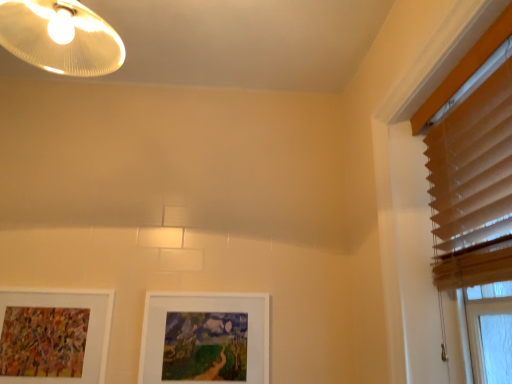
Question: From the image's perspective, does white matte picture frame at center, acting as the first picture frame starting from the right, appear lower than matte white lampshade at upper left?

Choices:
 (A) no
 (B) yes

Answer: (B)

Question: Does white matte picture frame at center, the 2th picture frame in the left-to-right sequence, appear on the right side of matte white lampshade at upper left?

Choices:
 (A) yes
 (B) no

Answer: (A)

Question: Considering the relative sizes of white matte picture frame at center, the 2th picture frame in the left-to-right sequence, and matte white lampshade at upper left in the image provided, is white matte picture frame at center, the 2th picture frame in the left-to-right sequence, wider than matte white lampshade at upper left?

Choices:
 (A) yes
 (B) no

Answer: (B)

Question: Is white matte picture frame at center, the 2th picture frame in the left-to-right sequence, looking in the opposite direction of matte white lampshade at upper left?

Choices:
 (A) no
 (B) yes

Answer: (A)

Question: Is matte white lampshade at upper left completely or partially inside white matte picture frame at center, the 2th picture frame in the left-to-right sequence?

Choices:
 (A) yes
 (B) no

Answer: (B)

Question: Is white matte picture frame at center, acting as the first picture frame starting from the right, outside of matte white lampshade at upper left?

Choices:
 (A) no
 (B) yes

Answer: (B)

Question: From a real-world perspective, is matte white lampshade at upper left physically below white matte picture frame at lower left, marked as the second picture frame in a right-to-left arrangement?

Choices:
 (A) yes
 (B) no

Answer: (B)

Question: Considering the relative sizes of matte white lampshade at upper left and white matte picture frame at lower left, marked as the second picture frame in a right-to-left arrangement, in the image provided, is matte white lampshade at upper left thinner than white matte picture frame at lower left, marked as the second picture frame in a right-to-left arrangement,?

Choices:
 (A) yes
 (B) no

Answer: (B)

Question: Would you say matte white lampshade at upper left is outside white matte picture frame at lower left, marked as the second picture frame in a right-to-left arrangement?

Choices:
 (A) yes
 (B) no

Answer: (A)

Question: Considering the relative sizes of matte white lampshade at upper left and white matte picture frame at lower left, marked as the second picture frame in a right-to-left arrangement, in the image provided, is matte white lampshade at upper left bigger than white matte picture frame at lower left, marked as the second picture frame in a right-to-left arrangement,?

Choices:
 (A) yes
 (B) no

Answer: (A)

Question: Can you confirm if matte white lampshade at upper left is positioned to the left of white matte picture frame at lower left, marked as the second picture frame in a right-to-left arrangement?

Choices:
 (A) no
 (B) yes

Answer: (A)

Question: Is matte white lampshade at upper left wider than white matte picture frame at lower left, arranged as the first picture frame when viewed from the left?

Choices:
 (A) no
 (B) yes

Answer: (B)

Question: From the image's perspective, is white matte picture frame at center, the 2th picture frame in the left-to-right sequence, over beige wood blinds at upper right?

Choices:
 (A) yes
 (B) no

Answer: (B)